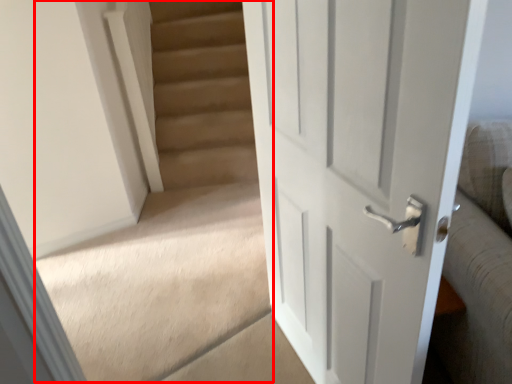
Question: From the image's perspective, considering the relative positions of stairwell (annotated by the red box) and door in the image provided, where is stairwell (annotated by the red box) located with respect to the staircase?

Choices:
 (A) below
 (B) above

Answer: (B)